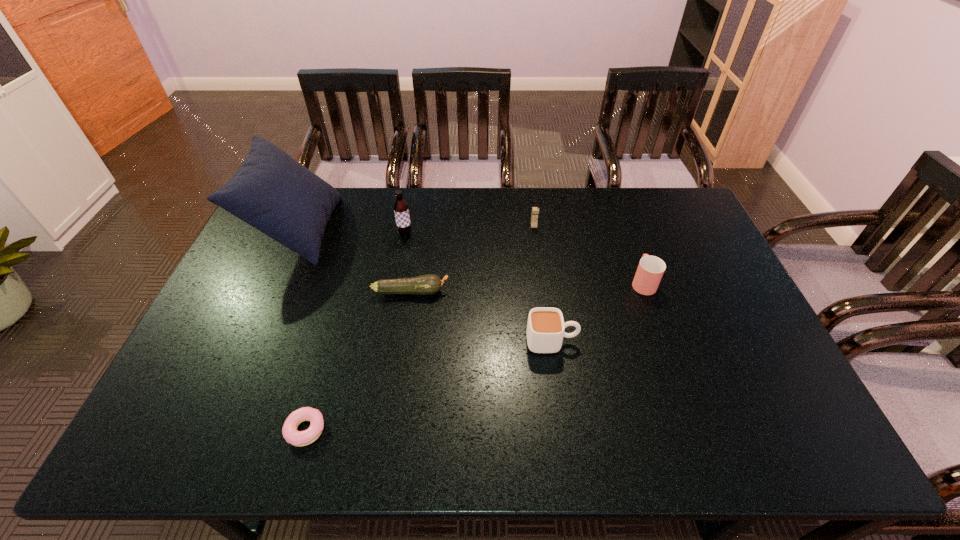
The image size is (960, 540). In order to click on the tallest object in this screenshot , I will do tap(271, 191).

The width and height of the screenshot is (960, 540). What are the coordinates of `cushion` in the screenshot? It's located at (271, 191).

Identify the location of root beer. This screenshot has height=540, width=960. (401, 209).

Where is `the fifth shortest object`? the fifth shortest object is located at coordinates (535, 210).

At what (x,y) coordinates should I click in order to perform the action: click on the rightmost object. Please return your answer as a coordinate pair (x, y). The height and width of the screenshot is (540, 960). Looking at the image, I should click on point(650,270).

You are a GUI agent. You are given a task and a screenshot of the screen. Output one action in this format:
    pyautogui.click(x=<x>, y=<y>)
    Task: Click on the right cup
    This screenshot has width=960, height=540.
    Given the screenshot: What is the action you would take?
    pyautogui.click(x=650, y=270)

I want to click on the left cup, so click(545, 329).

Where is `the sixth farthest object`? The image size is (960, 540). the sixth farthest object is located at coordinates (545, 329).

The image size is (960, 540). In order to click on zucchini in this screenshot , I will do `click(429, 284)`.

Where is `the nearest object`? The height and width of the screenshot is (540, 960). the nearest object is located at coordinates (289, 430).